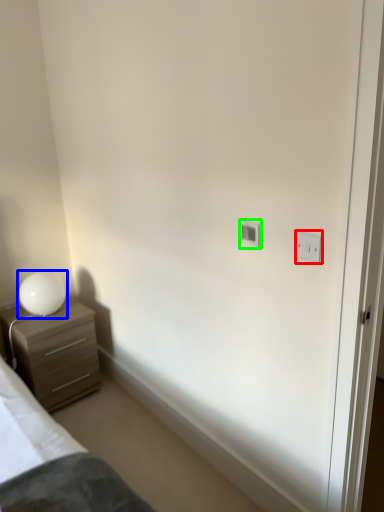
Question: Based on their relative distances, which object is farther from light switch (highlighted by a red box)? Choose from table lamp (highlighted by a blue box) and light switch (highlighted by a green box).

Choices:
 (A) table lamp
 (B) light switch

Answer: (A)